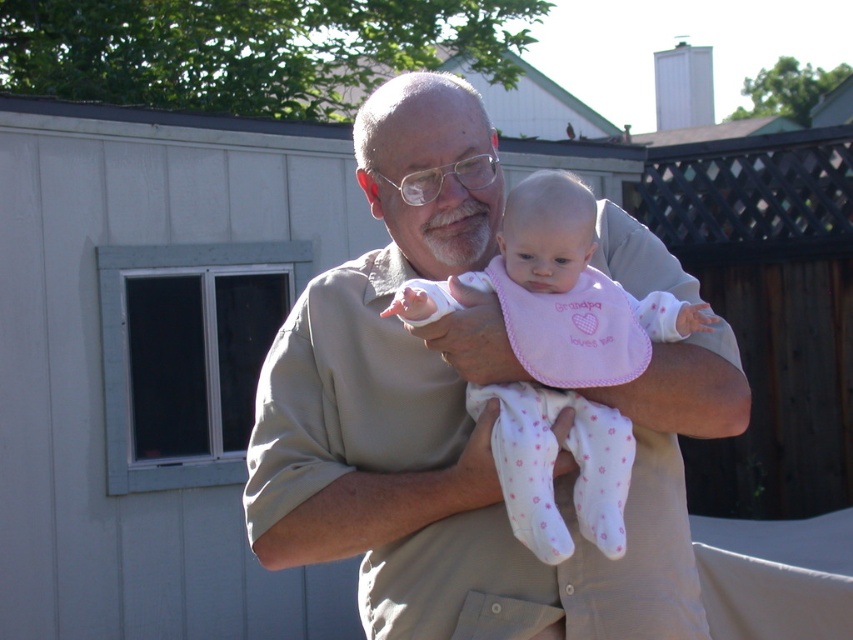
Does point (701, 339) come farther from viewer compared to point (570, 432)?

Yes.

Is khaki cotton shirt at center closer to camera compared to pink fabric bib at center?

No, it is not.

Consider the image. Measure the distance between khaki cotton shirt at center and camera.

khaki cotton shirt at center is 2.97 meters from camera.

This screenshot has width=853, height=640. In order to click on khaki cotton shirt at center in this screenshot , I will do `click(457, 417)`.